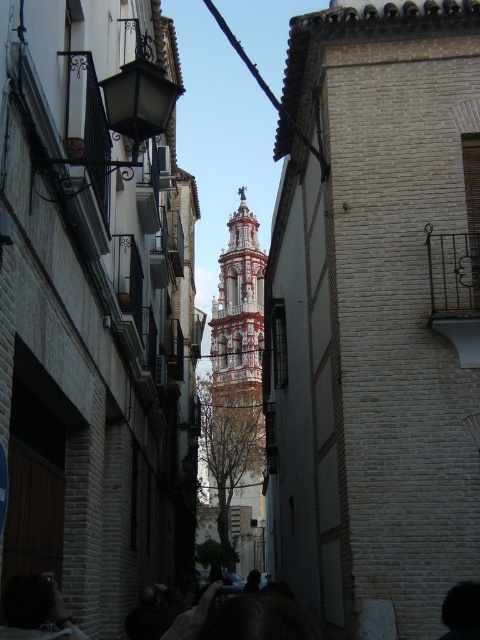
Which is below, white painted brick bell tower at center or dark brown hair at lower left?

dark brown hair at lower left is lower down.

Identify the location of white painted brick bell tower at center. (239, 304).

Find the location of a particular element. This screenshot has height=640, width=480. white painted brick bell tower at center is located at coordinates (239, 304).

Is dark brown hair at lower left above dark hair at lower right?

Correct, dark brown hair at lower left is located above dark hair at lower right.

Is dark brown hair at lower left further to camera compared to dark hair at lower right?

That is False.

Is point (6, 636) more distant than point (457, 605)?

No, it is not.

Identify the location of dark brown hair at lower left. The image size is (480, 640). (36, 611).

Is white painted brick bell tower at center shorter than dark hair at lower right?

In fact, white painted brick bell tower at center may be taller than dark hair at lower right.

The width and height of the screenshot is (480, 640). Identify the location of white painted brick bell tower at center. (239, 304).

Does point (252, 273) lie behind point (475, 598)?

Yes, point (252, 273) is farther from viewer.

Identify the location of white painted brick bell tower at center. (239, 304).